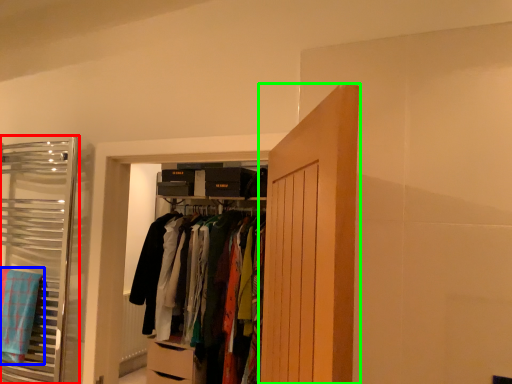
Question: Which is farther away from closet (highlighted by a red box)? bath towel (highlighted by a blue box) or door (highlighted by a green box)?

Choices:
 (A) bath towel
 (B) door

Answer: (B)